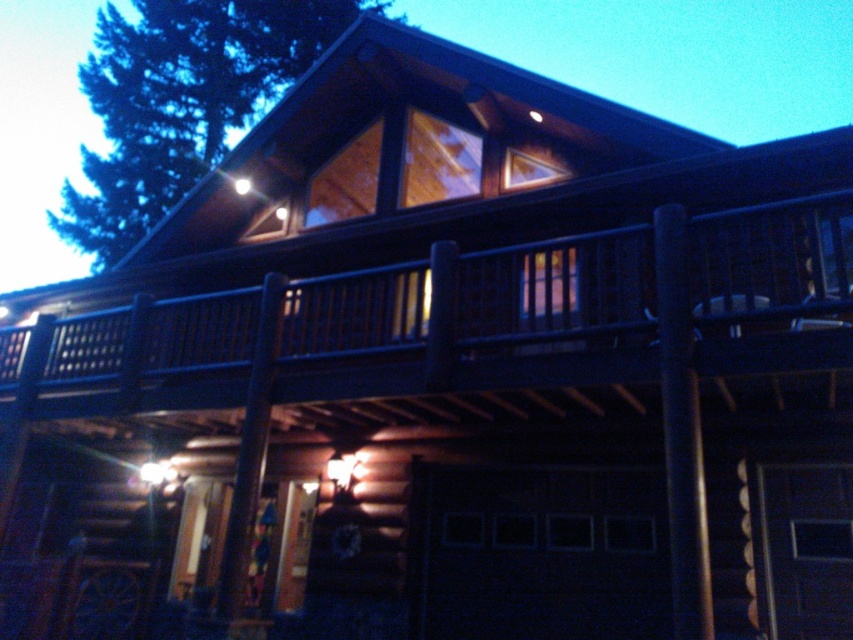
You are standing in front of the house and notice two points marked on the image. The first point is at coordinates point (277, 298) and the second at point (206, 84). Which point is closer to you?

Point (277, 298) is closer to the viewer than point (206, 84).